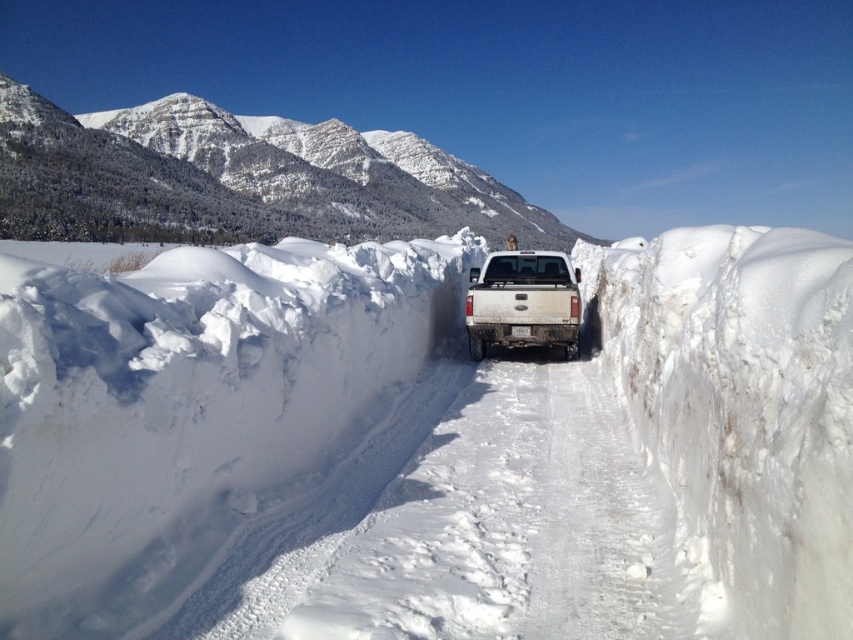
You are a hiker trying to find a safe spot to park your vehicle on the snowy path. According to the image, where is the white fluffy snow at center relative to the white matte truck at center?

The white fluffy snow at center is in front of the white matte truck at center, so the safe spot would be in front of the truck where the snow is fluffy and undisturbed.

You are planning to drive a car that is 5 meters long through the snowy path. The path is narrow and flanked by high snow banks. Given the presence of the white fluffy snow at center and the white matte truck at center, which object would you need to avoid hitting the sides of the path first?

The white fluffy snow at center is larger in size than the white matte truck at center, so you would need to avoid hitting the sides of the path first to accommodate the larger size of the white fluffy snow at center.

You are planning to take a photo of the snowy granite mountain at upper center and the white matte truck at center from a position where both are visible. Based on their heights, which object will appear larger in the photo?

The snowy granite mountain at upper center will appear larger in the photo because it has a greater height compared to the white matte truck at center.